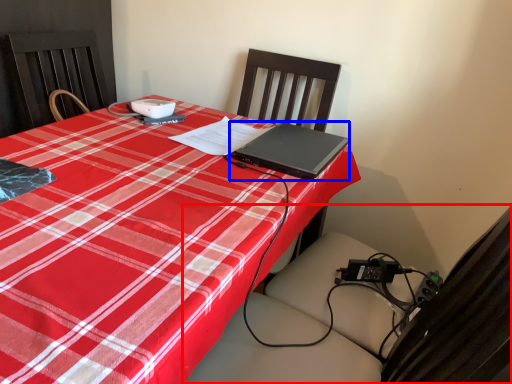
Question: Among these objects, which one is nearest to the camera, swivel chair (highlighted by a red box) or laptop (highlighted by a blue box)?

Choices:
 (A) swivel chair
 (B) laptop

Answer: (A)